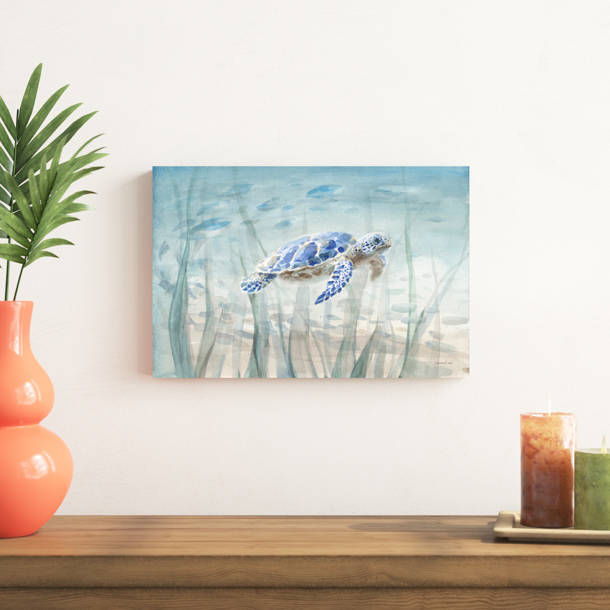
Identify the location of plate. (517, 529).